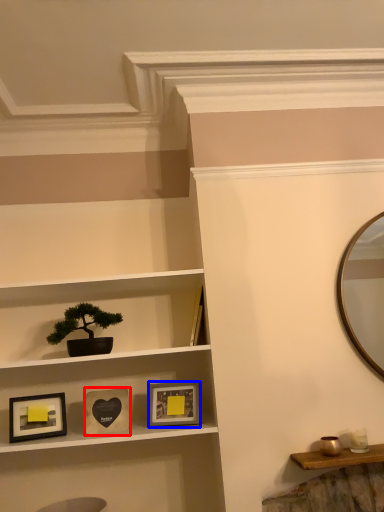
Question: Which of the following is the farthest to the observer, picture frame (highlighted by a red box) or picture frame (highlighted by a blue box)?

Choices:
 (A) picture frame
 (B) picture frame

Answer: (B)